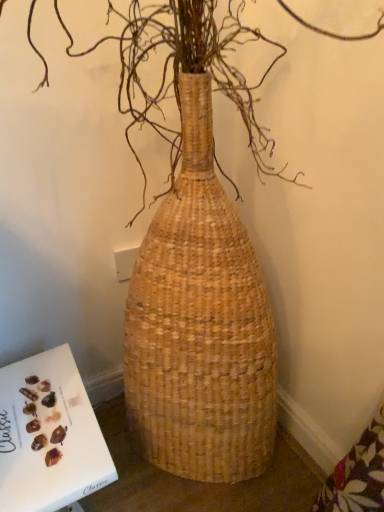
What do you see at coordinates (49, 435) in the screenshot?
I see `white paper book at lower left` at bounding box center [49, 435].

Where is `white paper book at lower left`? This screenshot has height=512, width=384. white paper book at lower left is located at coordinates (49, 435).

Identify the location of white paper book at lower left. This screenshot has height=512, width=384. (49, 435).